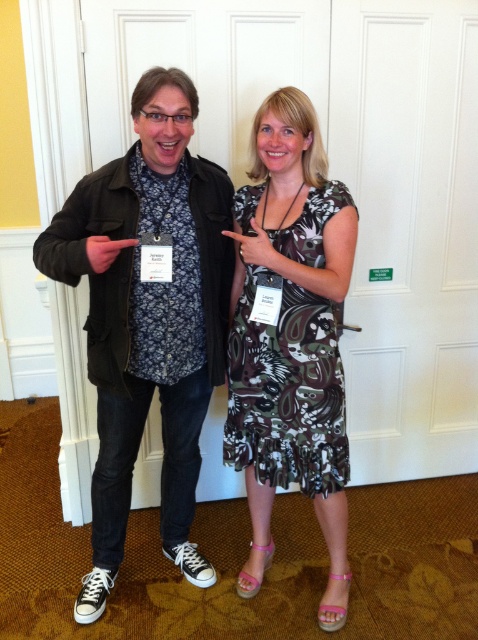
Question: Does black matte jacket at center come behind printed fabric dress at center?

Choices:
 (A) no
 (B) yes

Answer: (A)

Question: Can you confirm if black matte jacket at center is positioned to the right of printed fabric dress at center?

Choices:
 (A) yes
 (B) no

Answer: (B)

Question: Can you confirm if black matte jacket at center is positioned below printed fabric dress at center?

Choices:
 (A) yes
 (B) no

Answer: (A)

Question: Which of the following is the closest to the observer?

Choices:
 (A) printed fabric dress at center
 (B) black matte jacket at center

Answer: (B)